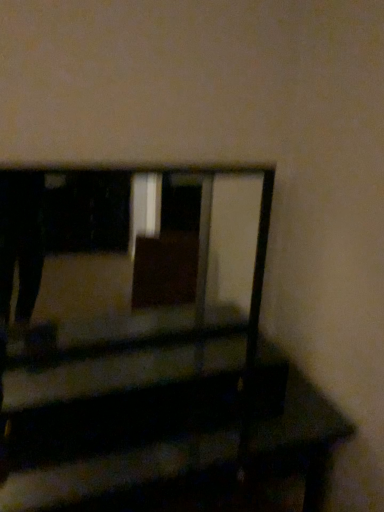
Where is `blank space situated above metallic dark brown table at lower right (from a real-world perspective)`? blank space situated above metallic dark brown table at lower right (from a real-world perspective) is located at coordinates (143, 361).